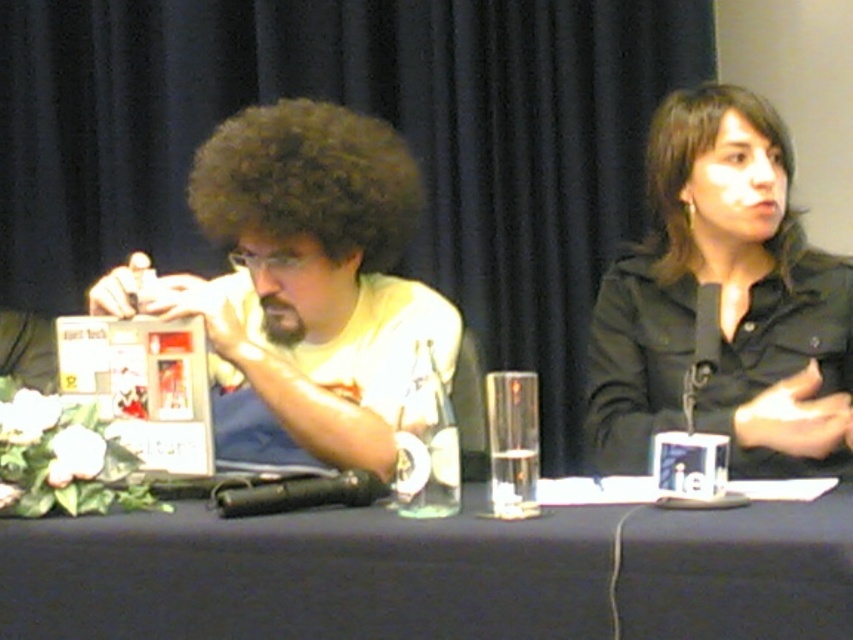
From the picture: You are a photographer positioned at the camera. You notice two points in the image, one at point (310, 177) and the other at point (659, 104). Which point is closer to your current position?

Point (310, 177) is closer to the camera than point (659, 104).

You are a photographer trying to capture a clear shot of both dark brown curly hair at center and dark brown curly hair at upper right. Which hair style should you focus on to ensure it fits entirely within your camera frame if your frame can only accommodate the narrower of the two?

You should focus on the dark brown curly hair at upper right because its width is narrower than the dark brown curly hair at center, making it more likely to fit within the camera frame.